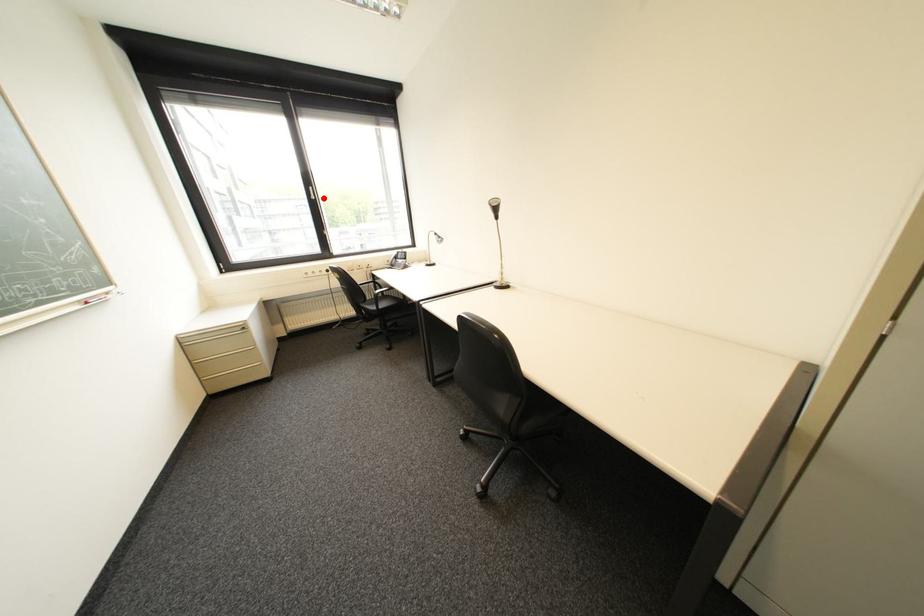
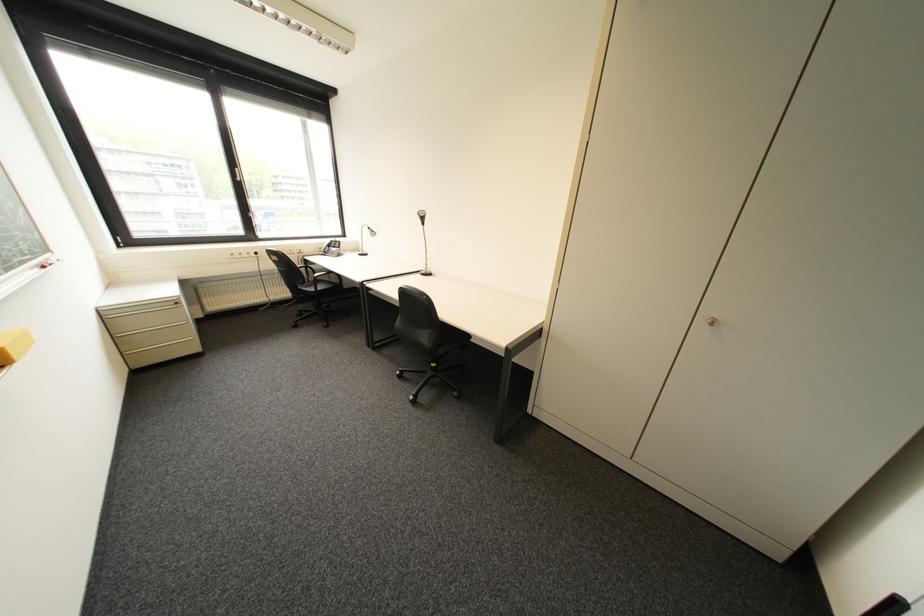
Where in the second image is the point corresponding to the highlighted location from the first image?

(249, 180)